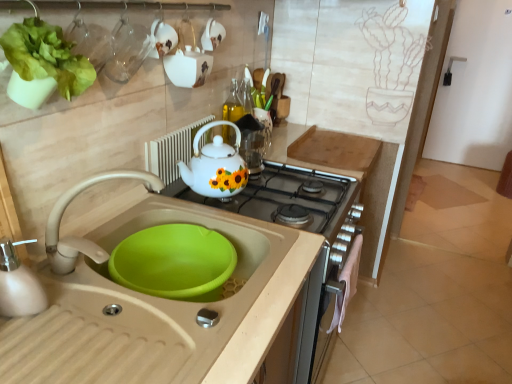
This screenshot has height=384, width=512. In order to click on free space to the back side of matte beige faucet at sink left in this screenshot , I will do `click(135, 221)`.